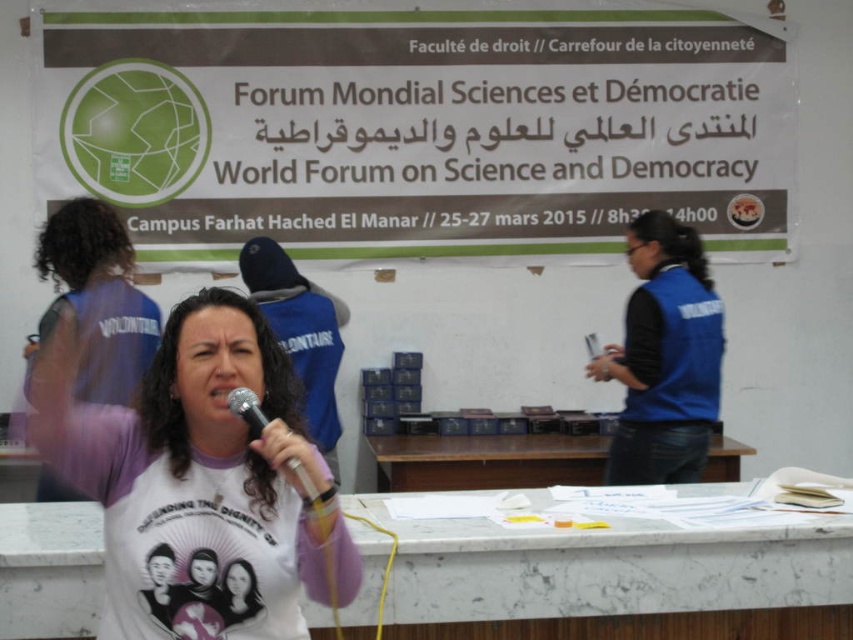
Can you confirm if white paperboard at upper center is bigger than blue fabric vest at center?

Yes.

This screenshot has height=640, width=853. Identify the location of white paperboard at upper center. (418, 129).

Identify the location of white paperboard at upper center. click(x=418, y=129).

At what (x,y) coordinates should I click in order to perform the action: click on white paperboard at upper center. Please return your answer as a coordinate pair (x, y). Looking at the image, I should click on (418, 129).

Does white paperboard at upper center appear on the left side of metallic silver microphone at center?

In fact, white paperboard at upper center is to the right of metallic silver microphone at center.

Which is in front, point (405, 208) or point (252, 404)?

Point (252, 404) is in front.

Where is `white paperboard at upper center`? This screenshot has width=853, height=640. white paperboard at upper center is located at coordinates (418, 129).